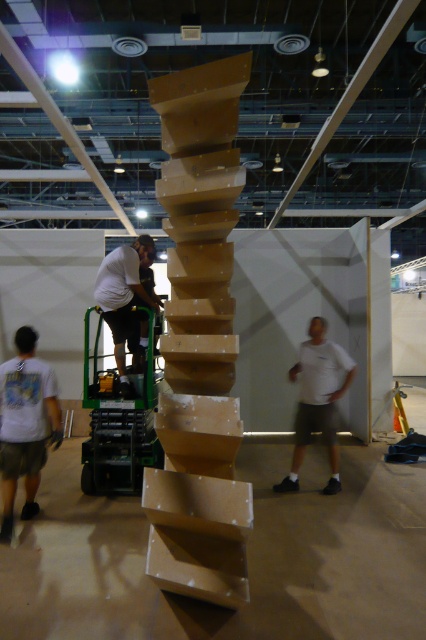
Can you confirm if white t-shirt at lower left is taller than white matte shirt at right?

No.

Looking at this image, is white t-shirt at lower left thinner than white matte shirt at right?

Yes, white t-shirt at lower left is thinner than white matte shirt at right.

Does point (40, 397) come closer to viewer compared to point (302, 372)?

Yes, it is in front of point (302, 372).

You are a GUI agent. You are given a task and a screenshot of the screen. Output one action in this format:
    pyautogui.click(x=<x>, y=<y>)
    Task: Click on the white t-shirt at lower left
    
    Given the screenshot: What is the action you would take?
    pyautogui.click(x=25, y=424)

Who is more distant from viewer, (308, 410) or (123, 259)?

Point (123, 259)

Which is above, white matte shirt at right or white matte shirt at center?

Positioned higher is white matte shirt at center.

This screenshot has height=640, width=426. What do you see at coordinates (317, 401) in the screenshot? I see `white matte shirt at right` at bounding box center [317, 401].

At what (x,y) coordinates should I click in order to perform the action: click on white matte shirt at right. Please return your answer as a coordinate pair (x, y). Looking at the image, I should click on (317, 401).

Is white t-shirt at lower left taller than white matte shirt at center?

In fact, white t-shirt at lower left may be shorter than white matte shirt at center.

Between white t-shirt at lower left and white matte shirt at center, which one appears on the right side from the viewer's perspective?

white matte shirt at center

Is point (29, 435) positioned after point (112, 305)?

No, it is in front of (112, 305).

Where is `white t-shirt at lower left`? This screenshot has height=640, width=426. white t-shirt at lower left is located at coordinates (25, 424).